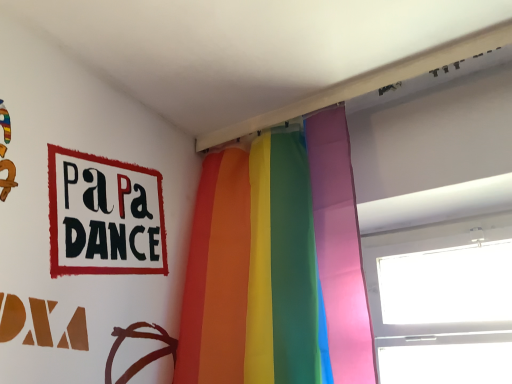
The height and width of the screenshot is (384, 512). What are the coordinates of `rainbow fabric curtain at center` in the screenshot? It's located at (277, 264).

What do you see at coordinates (277, 264) in the screenshot? Image resolution: width=512 pixels, height=384 pixels. I see `rainbow fabric curtain at center` at bounding box center [277, 264].

Identify the location of rainbow fabric curtain at center. This screenshot has height=384, width=512. (277, 264).